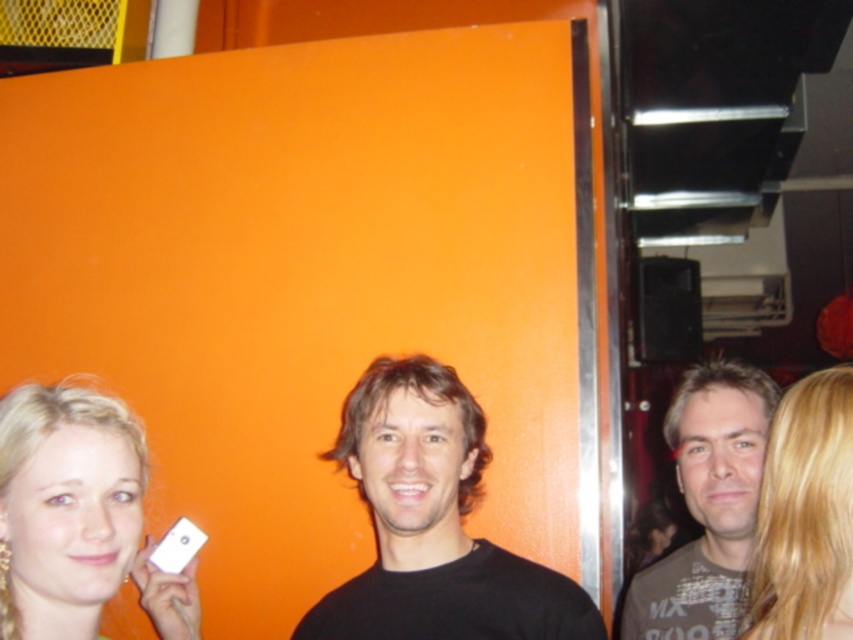
Question: Can you confirm if gray printed t-shirt at right is positioned above blonde hair at right?

Choices:
 (A) yes
 (B) no

Answer: (B)

Question: Which object is farther from the camera taking this photo?

Choices:
 (A) black matte shirt at center
 (B) gray printed t-shirt at right

Answer: (B)

Question: Which of the following is the farthest from the observer?

Choices:
 (A) (416, 388)
 (B) (190, 564)

Answer: (B)

Question: Is gray printed t-shirt at right positioned behind blonde hair at right?

Choices:
 (A) no
 (B) yes

Answer: (B)

Question: Is black matte shirt at center smaller than gray printed t-shirt at right?

Choices:
 (A) no
 (B) yes

Answer: (A)

Question: Which point is closer to the camera?

Choices:
 (A) (415, 368)
 (B) (15, 451)
 (C) (811, 509)
 (D) (753, 376)

Answer: (C)